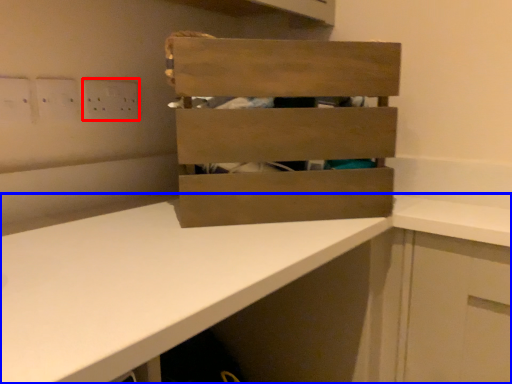
Question: Which object appears closest to the camera in this image, electric outlet (highlighted by a red box) or countertop (highlighted by a blue box)?

Choices:
 (A) electric outlet
 (B) countertop

Answer: (B)